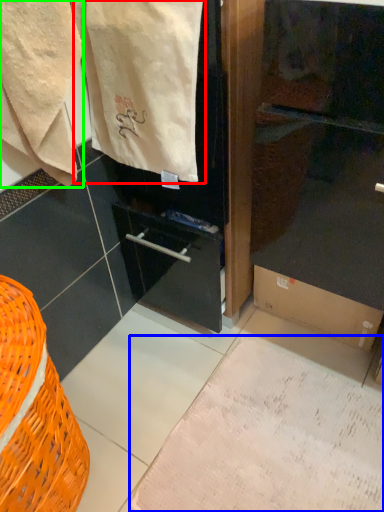
Question: Estimate the real-world distances between objects in this image. Which object is farther from bath towel (highlighted by a red box), parchment (highlighted by a blue box) or towel (highlighted by a green box)?

Choices:
 (A) parchment
 (B) towel

Answer: (A)